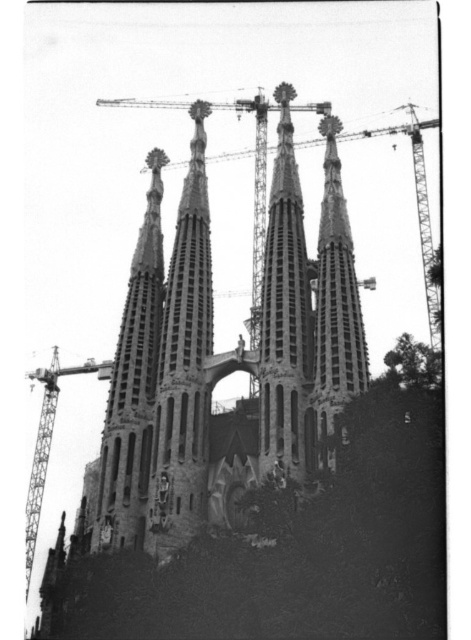
Question: Which is nearer to the rough stone spire at center?

Choices:
 (A) metallic crane at left
 (B) smooth stone tower at center
 (C) metallic construction crane at center
 (D) dark gray stone tower at center

Answer: (B)

Question: Can you confirm if rough stone spire at center is positioned to the right of metallic construction crane at center?

Choices:
 (A) no
 (B) yes

Answer: (A)

Question: Among these points, which one is farthest from the camera?

Choices:
 (A) (200, 372)
 (B) (99, 369)
 (C) (194, 113)
 (D) (308, 108)

Answer: (D)

Question: Can you confirm if metallic construction crane at center is positioned to the right of metallic crane at left?

Choices:
 (A) yes
 (B) no

Answer: (A)

Question: Among these objects, which one is farthest from the camera?

Choices:
 (A) stone church at center
 (B) rough stone spire at center
 (C) metallic construction crane at center
 (D) metallic crane at left

Answer: (C)

Question: Considering the relative positions of stone church at center and smooth stone tower at center in the image provided, where is stone church at center located with respect to smooth stone tower at center?

Choices:
 (A) left
 (B) right

Answer: (A)